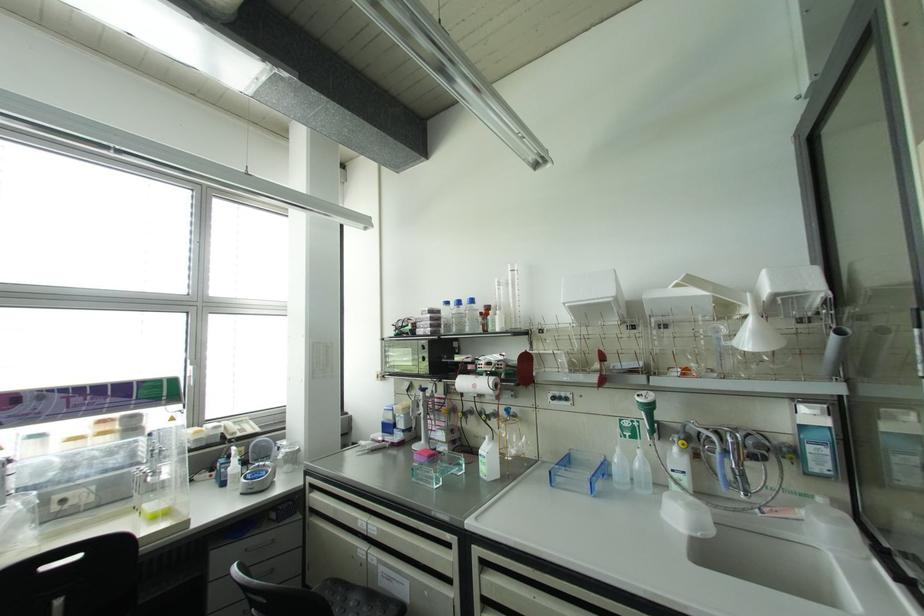
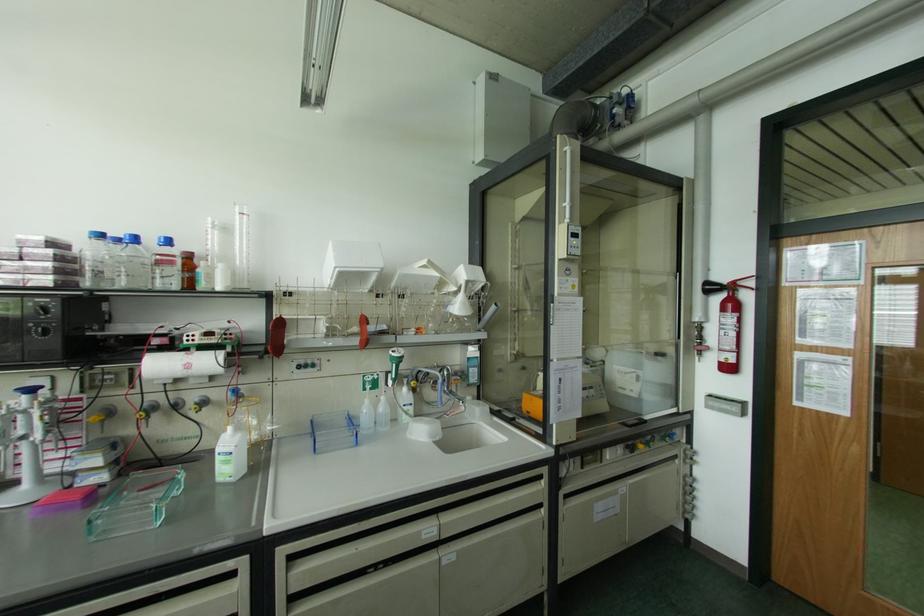
In the second image, find the point that corresponds to (446,302) in the first image.

(101, 236)